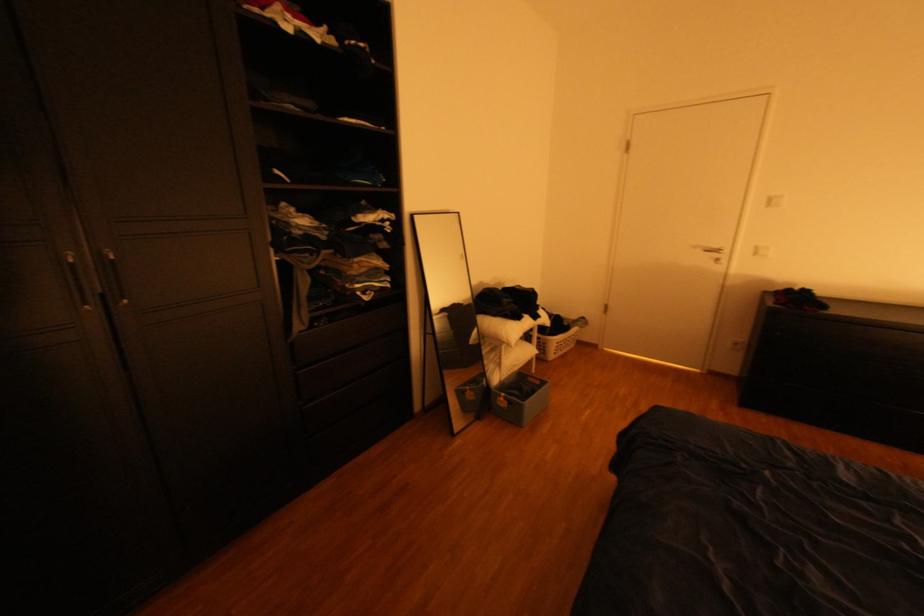
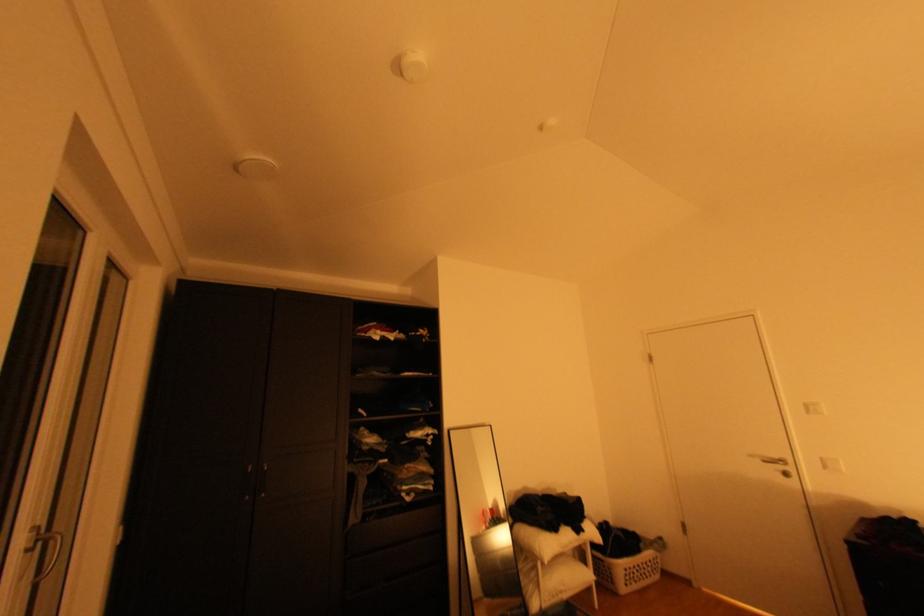
The images are taken continuously from a first-person perspective. In which direction is your viewpoint rotating?

The rotation direction of the camera is left-up.